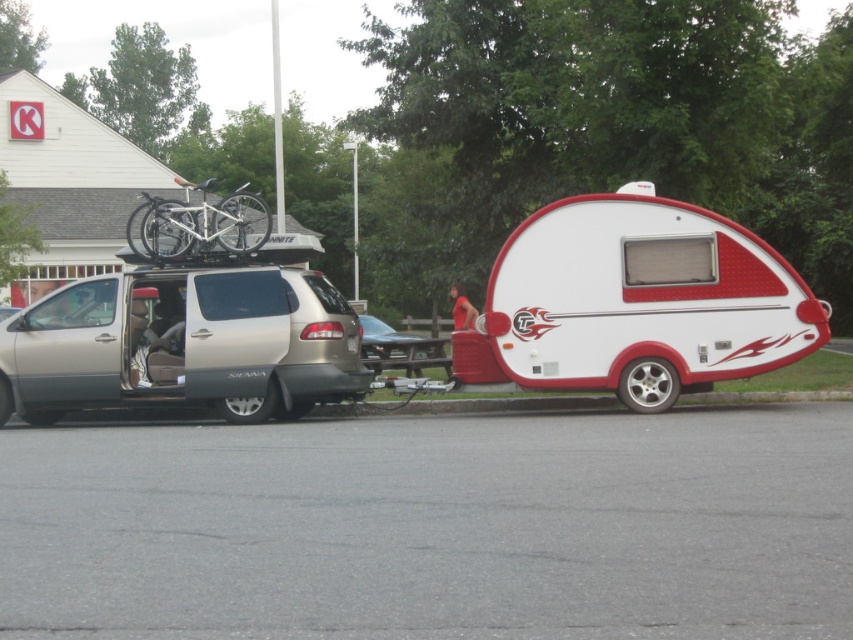
Can you confirm if white matte camper at center is wider than satin silver van at left?

In fact, white matte camper at center might be narrower than satin silver van at left.

Is white matte camper at center in front of satin silver van at left?

Yes, white matte camper at center is closer to the viewer.

What do you see at coordinates (635, 301) in the screenshot? I see `white matte camper at center` at bounding box center [635, 301].

This screenshot has width=853, height=640. What are the coordinates of `white matte camper at center` in the screenshot? It's located at (635, 301).

Between satin silver van at left and white matte bicycle at upper left, which one has less height?

With less height is satin silver van at left.

Between satin silver van at left and white matte bicycle at upper left, which one is positioned lower?

satin silver van at left

This screenshot has height=640, width=853. What do you see at coordinates (183, 344) in the screenshot?
I see `satin silver van at left` at bounding box center [183, 344].

Image resolution: width=853 pixels, height=640 pixels. In order to click on satin silver van at left in this screenshot , I will do `click(183, 344)`.

Measure the distance between point (671, 288) and camera.

Point (671, 288) and camera are 14.98 meters apart from each other.

Describe the element at coordinates (635, 301) in the screenshot. I see `white matte camper at center` at that location.

Is point (793, 349) in front of point (177, 205)?

Yes, it is in front of point (177, 205).

You are a GUI agent. You are given a task and a screenshot of the screen. Output one action in this format:
    pyautogui.click(x=<x>, y=<y>)
    Task: Click on the white matte camper at center
    This screenshot has height=640, width=853.
    Given the screenshot: What is the action you would take?
    pyautogui.click(x=635, y=301)